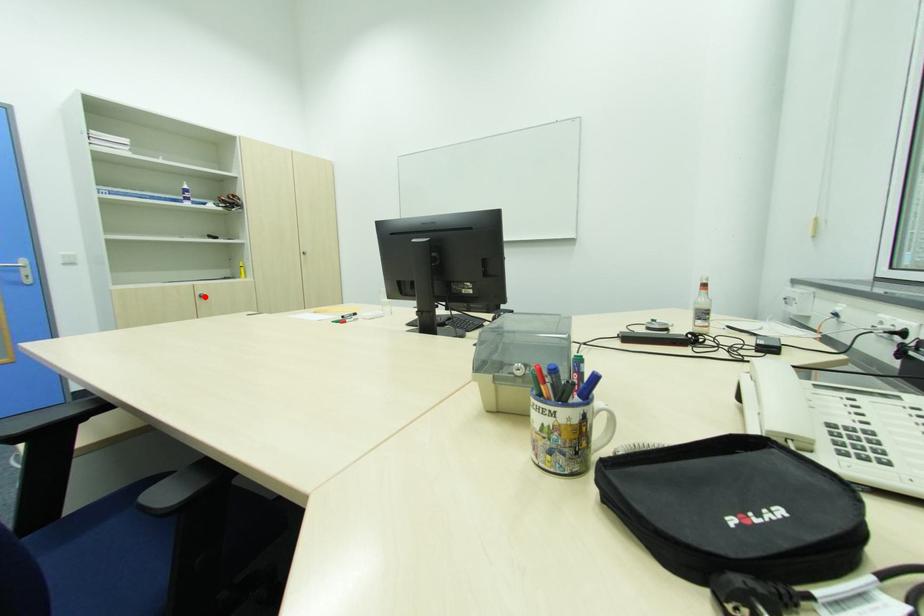
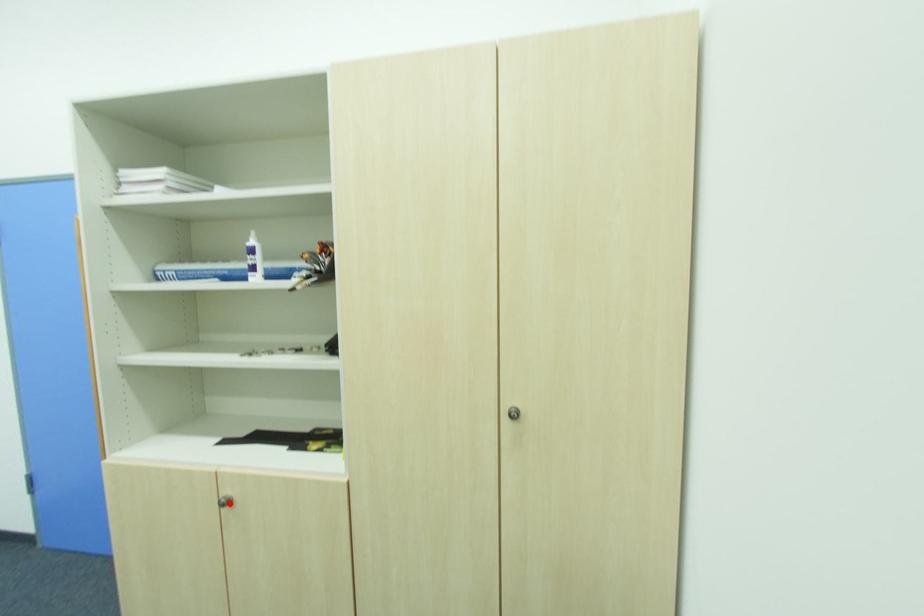
I am providing you with two images of the same scene from different viewpoints. A red point is marked on the first image and another point is marked on the second image. Are the points marked in image1 and image2 representing the same 3D position?

Yes